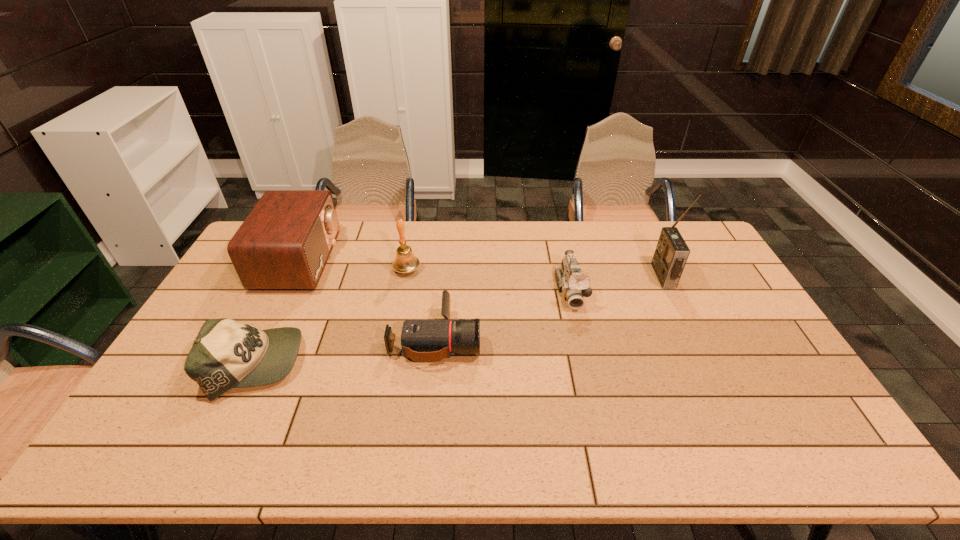
Where is `the taller radio receiver`? The image size is (960, 540). the taller radio receiver is located at coordinates (671, 253).

This screenshot has width=960, height=540. I want to click on the tallest object, so click(671, 253).

Image resolution: width=960 pixels, height=540 pixels. What are the coordinates of `bell` in the screenshot? It's located at (405, 262).

Where is `the shorter radio receiver`? This screenshot has width=960, height=540. the shorter radio receiver is located at coordinates (284, 243).

Locate an element on the screen. the taller camcorder is located at coordinates (574, 285).

At what (x,y) coordinates should I click in order to perform the action: click on the second object from right to left. Please return your answer as a coordinate pair (x, y). The height and width of the screenshot is (540, 960). Looking at the image, I should click on (574, 285).

Where is `baseball cap`? The width and height of the screenshot is (960, 540). baseball cap is located at coordinates (226, 354).

Image resolution: width=960 pixels, height=540 pixels. I want to click on the left camcorder, so click(424, 341).

This screenshot has width=960, height=540. I want to click on vacant space situated on the display of the taller radio receiver, so click(x=539, y=276).

Where is `free region located on the display of the taller radio receiver`? free region located on the display of the taller radio receiver is located at coordinates (539, 276).